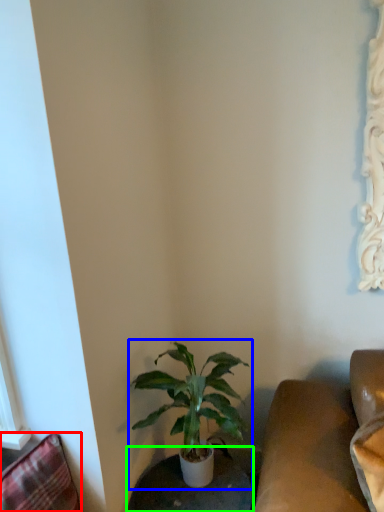
Question: Which object is the farthest from swivel chair (highlighted by a red box)? Choose among these: houseplant (highlighted by a blue box) or round table (highlighted by a green box).

Choices:
 (A) houseplant
 (B) round table

Answer: (B)